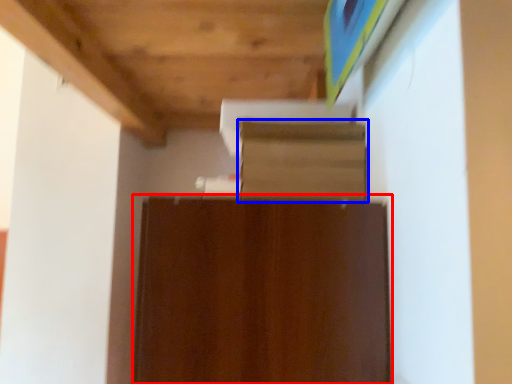
Question: Among these objects, which one is nearest to the camera, cabinetry (highlighted by a red box) or shelf (highlighted by a blue box)?

Choices:
 (A) cabinetry
 (B) shelf

Answer: (A)